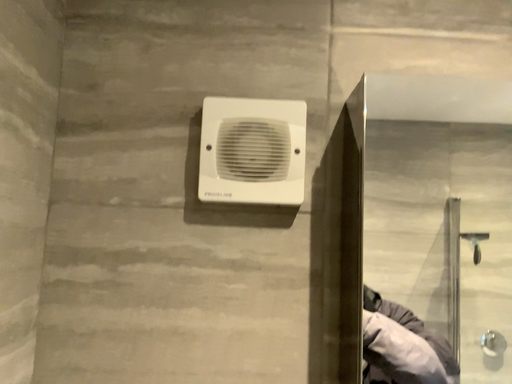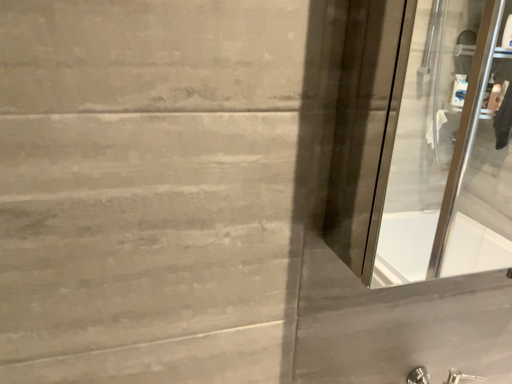
Question: Which way did the camera rotate in the video?

Choices:
 (A) rotated left
 (B) rotated right

Answer: (B)